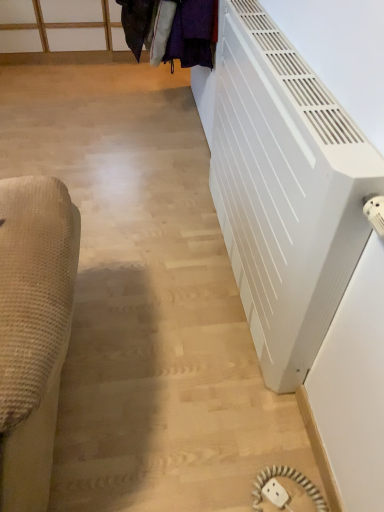
Locate an element on the screen. free area behind white matte radiator at right is located at coordinates (167, 173).